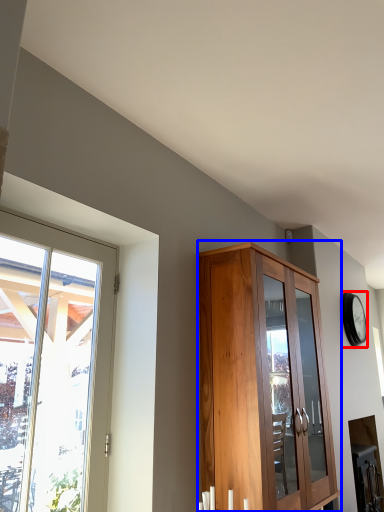
Question: Which point is further to the camera, clock (highlighted by a red box) or cupboard (highlighted by a blue box)?

Choices:
 (A) clock
 (B) cupboard

Answer: (A)